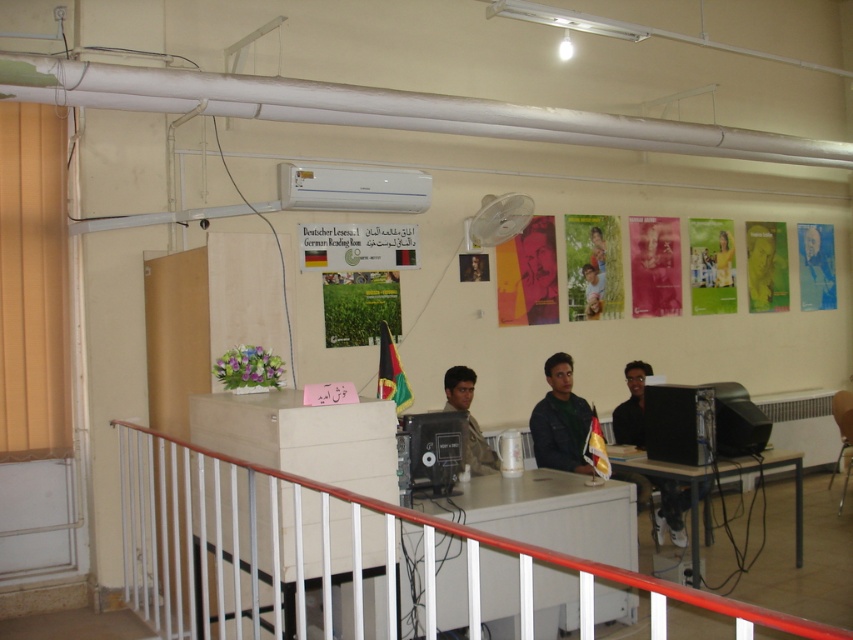
Between point (703, 474) and point (825, 234), which one is positioned in front?

Point (703, 474)

Which is more to the right, wooden table at lower right or blue fabric shirt at center?

From the viewer's perspective, blue fabric shirt at center appears more on the right side.

Is point (773, 467) farther from camera compared to point (805, 307)?

That is False.

Where is `wooden table at lower right`? The image size is (853, 640). wooden table at lower right is located at coordinates (721, 477).

Between matte khaki uniform at center and matte green shirt at center, which one is positioned higher?

matte green shirt at center is higher up.

Can you confirm if matte khaki uniform at center is positioned to the right of matte green shirt at center?

No, matte khaki uniform at center is not to the right of matte green shirt at center.

Does point (448, 381) come behind point (604, 280)?

No, (448, 381) is in front of (604, 280).

At what (x,y) coordinates should I click in order to perform the action: click on matte khaki uniform at center. Please return your answer as a coordinate pair (x, y). The image size is (853, 640). Looking at the image, I should click on (468, 419).

Is dark green leather jacket at center positioned at the back of matte khaki uniform at center?

That is True.

Can you confirm if dark green leather jacket at center is positioned to the left of matte khaki uniform at center?

Incorrect, dark green leather jacket at center is not on the left side of matte khaki uniform at center.

Does point (581, 440) come farther from viewer compared to point (469, 465)?

That is True.

What are the coordinates of `dark green leather jacket at center` in the screenshot? It's located at (560, 419).